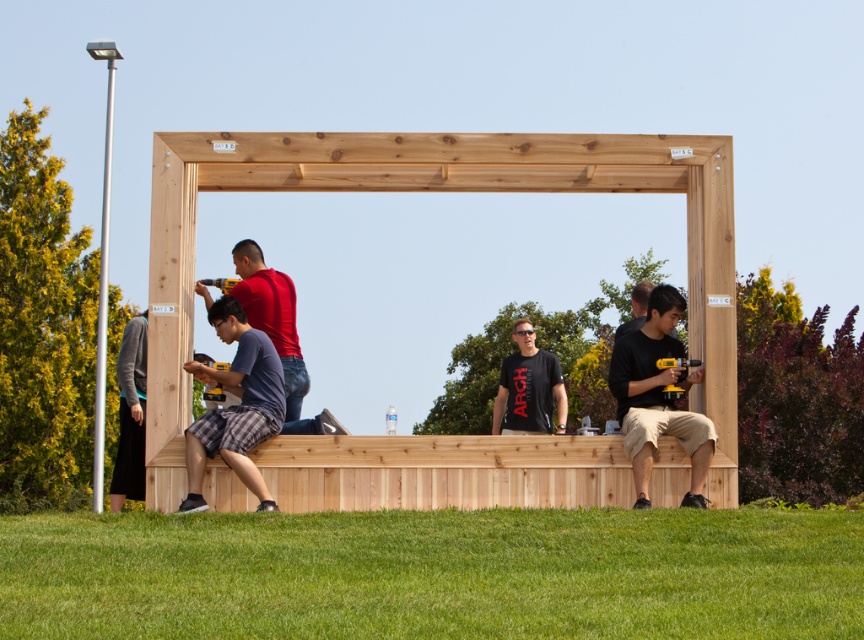
What do you see at coordinates (443, 472) in the screenshot? I see `natural wood bench at center` at bounding box center [443, 472].

Is natural wood bench at center shorter than black matte t-shirt at center?

Correct, natural wood bench at center is not as tall as black matte t-shirt at center.

What do you see at coordinates (443, 472) in the screenshot? The width and height of the screenshot is (864, 640). I see `natural wood bench at center` at bounding box center [443, 472].

This screenshot has width=864, height=640. What are the coordinates of `natural wood bench at center` in the screenshot? It's located at (443, 472).

Looking at this image, can you confirm if natural wood frame at center is shorter than matte red shirt at center?

Incorrect, natural wood frame at center's height does not fall short of matte red shirt at center's.

Does natural wood frame at center appear on the left side of matte red shirt at center?

In fact, natural wood frame at center is to the right of matte red shirt at center.

Which is behind, point (418, 156) or point (307, 378)?

The point (307, 378) is behind.

Find the location of a particular element. The width and height of the screenshot is (864, 640). natural wood frame at center is located at coordinates (435, 189).

Is point (700, 499) behind point (226, 433)?

Yes, it is behind point (226, 433).

What do you see at coordinates (658, 397) in the screenshot?
I see `matte black shirt at center` at bounding box center [658, 397].

Is point (626, 339) farther from camera compared to point (246, 372)?

That is True.

Locate an element on the screen. matte black shirt at center is located at coordinates (658, 397).